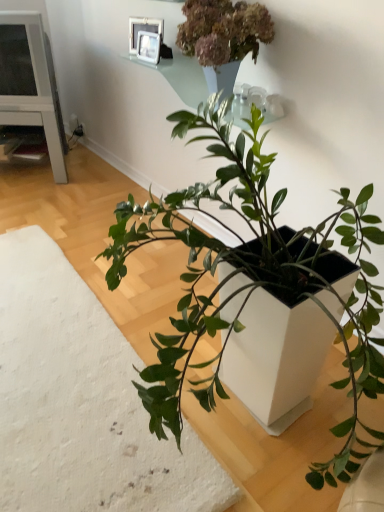
Question: Is white matte planter at lower left not inside metallic silver picture frame at upper center, which ranks as the first picture frame in bottom-to-top order?

Choices:
 (A) yes
 (B) no

Answer: (A)

Question: Is white matte planter at lower left bigger than metallic silver picture frame at upper center, which ranks as the first picture frame in bottom-to-top order?

Choices:
 (A) yes
 (B) no

Answer: (A)

Question: Is metallic silver picture frame at upper center, which ranks as the first picture frame in bottom-to-top order, at the back of white matte planter at lower left?

Choices:
 (A) no
 (B) yes

Answer: (A)

Question: Does white matte planter at lower left contain metallic silver picture frame at upper center, which ranks as the first picture frame in bottom-to-top order?

Choices:
 (A) no
 (B) yes

Answer: (A)

Question: Is white matte planter at lower left thinner than metallic silver picture frame at upper center, marked as the 2th picture frame in a top-to-bottom arrangement?

Choices:
 (A) yes
 (B) no

Answer: (B)

Question: Considering the positions of white matte planter at center, marked as the 1th houseplant in a left-to-right arrangement, and white glossy picture frame at upper center, arranged as the second picture frame when ordered from the bottom, in the image, is white matte planter at center, marked as the 1th houseplant in a left-to-right arrangement, wider or thinner than white glossy picture frame at upper center, arranged as the second picture frame when ordered from the bottom,?

Choices:
 (A) wide
 (B) thin

Answer: (A)

Question: From their relative heights in the image, would you say white matte planter at center, marked as the 1th houseplant in a left-to-right arrangement, is taller or shorter than white glossy picture frame at upper center, arranged as the second picture frame when ordered from the bottom?

Choices:
 (A) tall
 (B) short

Answer: (B)

Question: Do you think white matte planter at center, marked as the 1th houseplant in a left-to-right arrangement, is within white glossy picture frame at upper center, which is the first picture frame in top-to-bottom order, or outside of it?

Choices:
 (A) outside
 (B) inside

Answer: (A)

Question: Is white matte planter at center, marked as the 1th houseplant in a left-to-right arrangement, in front of or behind white glossy picture frame at upper center, arranged as the second picture frame when ordered from the bottom, in the image?

Choices:
 (A) behind
 (B) front

Answer: (B)

Question: From a real-world perspective, is white matte planter at lower left above or below white glossy picture frame at upper center, arranged as the second picture frame when ordered from the bottom?

Choices:
 (A) below
 (B) above

Answer: (A)

Question: Considering the positions of point (89, 409) and point (153, 23), is point (89, 409) closer or farther from the camera than point (153, 23)?

Choices:
 (A) farther
 (B) closer

Answer: (B)

Question: Is white matte planter at lower left taller or shorter than white glossy picture frame at upper center, arranged as the second picture frame when ordered from the bottom?

Choices:
 (A) tall
 (B) short

Answer: (B)

Question: Considering the relative positions of white matte planter at lower left and white glossy picture frame at upper center, arranged as the second picture frame when ordered from the bottom, in the image provided, is white matte planter at lower left to the left or to the right of white glossy picture frame at upper center, arranged as the second picture frame when ordered from the bottom,?

Choices:
 (A) right
 (B) left

Answer: (B)

Question: Considering the positions of point (28, 506) and point (326, 477), is point (28, 506) closer or farther from the camera than point (326, 477)?

Choices:
 (A) farther
 (B) closer

Answer: (A)

Question: From a real-world perspective, is white matte planter at lower left positioned above or below white matte planter at center, which ranks as the 2th houseplant in right-to-left order?

Choices:
 (A) above
 (B) below

Answer: (A)